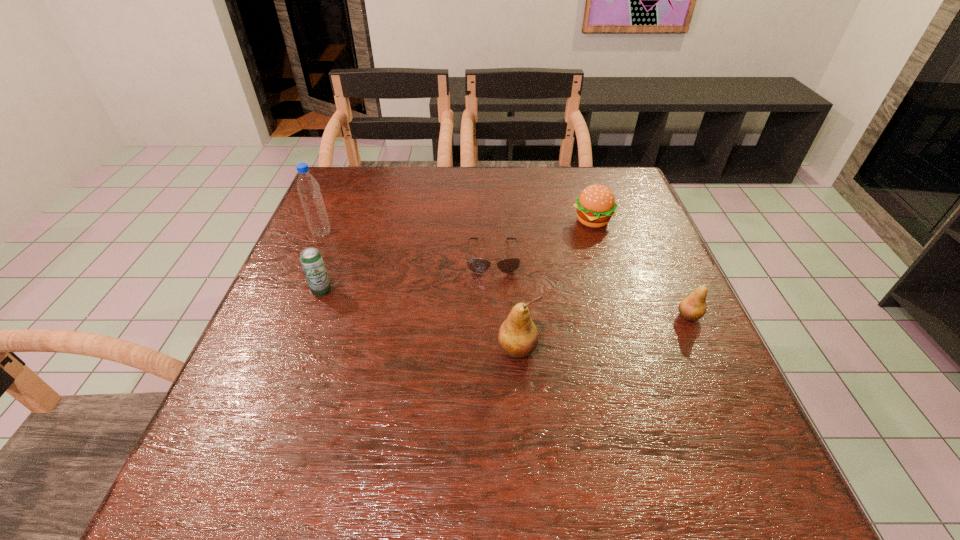
Identify the location of the nearest object. Image resolution: width=960 pixels, height=540 pixels. (518, 337).

You are a GUI agent. You are given a task and a screenshot of the screen. Output one action in this format:
    pyautogui.click(x=<x>, y=<y>)
    Task: Click on the taller pear
    The height and width of the screenshot is (540, 960).
    Given the screenshot: What is the action you would take?
    pyautogui.click(x=518, y=337)

This screenshot has width=960, height=540. Find the location of `the second nearest object`. the second nearest object is located at coordinates (693, 307).

Where is `the right pear`? The width and height of the screenshot is (960, 540). the right pear is located at coordinates (693, 307).

At what (x,y) coordinates should I click in order to perform the action: click on water bottle. Please return your answer as a coordinate pair (x, y). The height and width of the screenshot is (540, 960). Looking at the image, I should click on (308, 188).

Where is `the tallest object`? The image size is (960, 540). the tallest object is located at coordinates (308, 188).

Locate an element on the screen. The image size is (960, 540). hamburger is located at coordinates (596, 204).

This screenshot has height=540, width=960. I want to click on the third nearest object, so click(x=311, y=259).

The height and width of the screenshot is (540, 960). I want to click on the second object from left to right, so click(311, 259).

Identify the location of sunglasses. (476, 265).